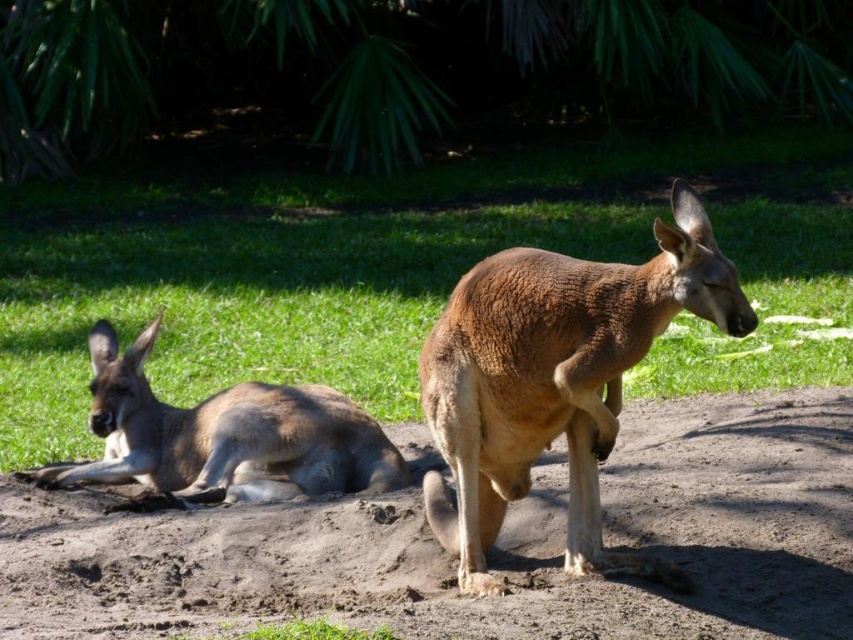
You are a small animal trying to jump from the brown sandy dirt at center to the brown fur kangaroo at lower left. Can you reach it in one jump if your maximum jump distance is 25 inches?

The brown sandy dirt at center is 28.15 inches away from the brown fur kangaroo at lower left. Since your maximum jump distance is 25 inches, you cannot reach it in one jump.

You are standing at the point labeled as point [490,552] in the image. Looking around, you see the two kangaroos described in the scene. Which direction should you move to reach the nearest kangaroo?

The point [490,552] corresponds to brown sandy dirt at center. Since the kangaroo on the left is lying down on the ground at the left side and the kangaroo on the right is standing at the right side, the nearest kangaroo would depend on their exact positions. However, based on the coordinates given, moving towards the center might not lead directly to either. Without specific distance data between the point and each kangaroo, it is impossible to determine the nearest direction accurately.